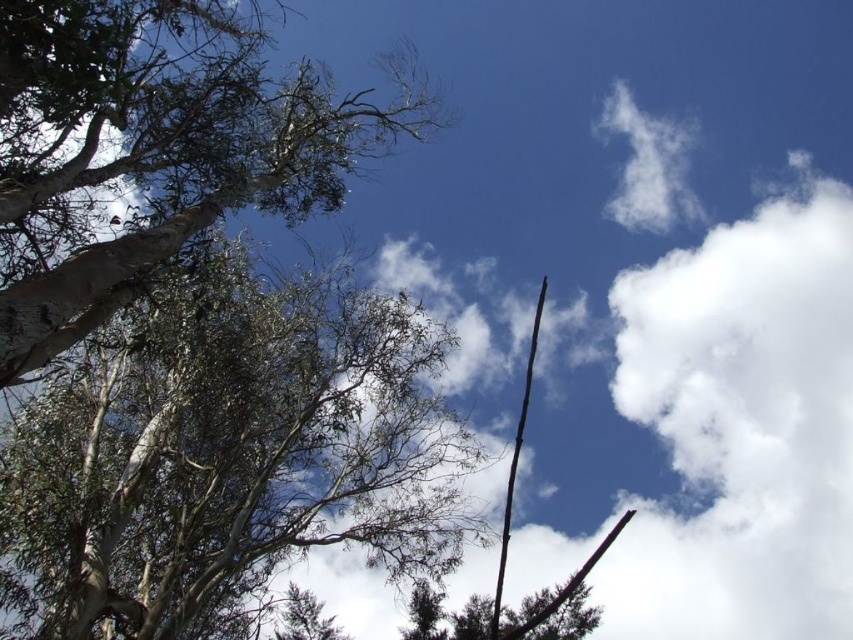
Is point (227, 321) farther from viewer compared to point (16, 76)?

That is True.

Is green rough bark tree at upper left thinner than green leafy tree at upper left?

Yes, green rough bark tree at upper left is thinner than green leafy tree at upper left.

Which is behind, point (154, 381) or point (115, 266)?

The point (154, 381) is more distant.

At what (x,y) coordinates should I click in order to perform the action: click on green rough bark tree at upper left. Please return your answer as a coordinate pair (x, y). Image resolution: width=853 pixels, height=640 pixels. Looking at the image, I should click on (225, 451).

Does green rough bark tree at upper left have a smaller size compared to white fluffy cloud at upper right?

Indeed, green rough bark tree at upper left has a smaller size compared to white fluffy cloud at upper right.

Does green rough bark tree at upper left have a lesser width compared to white fluffy cloud at upper right?

Indeed, green rough bark tree at upper left has a lesser width compared to white fluffy cloud at upper right.

Locate an element on the screen. This screenshot has width=853, height=640. green rough bark tree at upper left is located at coordinates (225, 451).

Who is more forward, (346, 124) or (665, 173)?

Point (346, 124) is more forward.

Who is higher up, green leafy tree at upper left or white fluffy cloud at upper right?

white fluffy cloud at upper right is above.

Image resolution: width=853 pixels, height=640 pixels. Describe the element at coordinates (154, 148) in the screenshot. I see `green leafy tree at upper left` at that location.

Where is `green leafy tree at upper left`? This screenshot has height=640, width=853. green leafy tree at upper left is located at coordinates (154, 148).